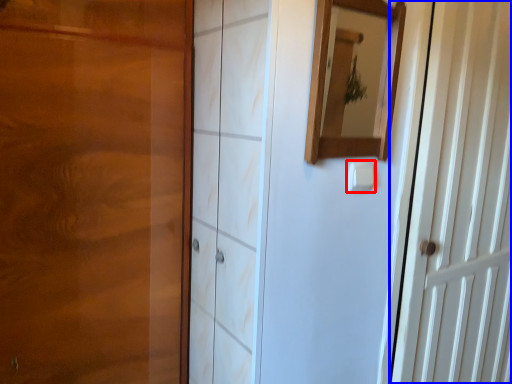
Question: Which point is further to the camera, light switch (highlighted by a red box) or door (highlighted by a blue box)?

Choices:
 (A) light switch
 (B) door

Answer: (B)